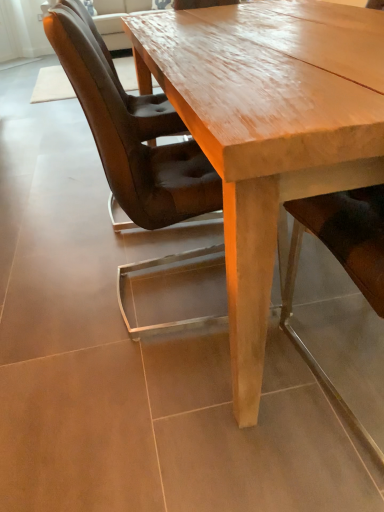
Question: Is the depth of smooth leather chair at center, which is the 2th chair from left to right, greater than that of brown leather chair at left, which appears as the second chair when viewed from the right?

Choices:
 (A) no
 (B) yes

Answer: (A)

Question: Are smooth leather chair at center, which is the 2th chair from left to right, and brown leather chair at left, which is the second chair in front-to-back order, located far from each other?

Choices:
 (A) yes
 (B) no

Answer: (B)

Question: Is smooth leather chair at center, the first chair when ordered from front to back, wider than brown leather chair at left, which appears as the second chair when viewed from the right?

Choices:
 (A) no
 (B) yes

Answer: (B)

Question: Is smooth leather chair at center, positioned as the second chair in back-to-front order, aimed at brown leather chair at left, which is the second chair in front-to-back order?

Choices:
 (A) yes
 (B) no

Answer: (B)

Question: From a real-world perspective, does smooth leather chair at center, positioned as the second chair in back-to-front order, sit lower than brown leather chair at left, which ranks as the 1th chair in left-to-right order?

Choices:
 (A) yes
 (B) no

Answer: (A)

Question: Is brown leather chair at left, the first chair viewed from the back, spatially inside light brown polished wood table at center, or outside of it?

Choices:
 (A) inside
 (B) outside

Answer: (A)

Question: Looking at the image, does brown leather chair at left, which appears as the second chair when viewed from the right, seem bigger or smaller compared to light brown polished wood table at center?

Choices:
 (A) small
 (B) big

Answer: (A)

Question: From the image's perspective, is brown leather chair at left, which appears as the second chair when viewed from the right, positioned above or below light brown polished wood table at center?

Choices:
 (A) above
 (B) below

Answer: (A)

Question: From a real-world perspective, is brown leather chair at left, which is the second chair in front-to-back order, physically located above or below light brown polished wood table at center?

Choices:
 (A) above
 (B) below

Answer: (A)

Question: In terms of height, does light brown polished wood table at center look taller or shorter compared to brown leather chair at left, which appears as the second chair when viewed from the right?

Choices:
 (A) short
 (B) tall

Answer: (A)

Question: Considering their positions, is light brown polished wood table at center located in front of or behind brown leather chair at left, which appears as the second chair when viewed from the right?

Choices:
 (A) front
 (B) behind

Answer: (A)

Question: Considering the positions of light brown polished wood table at center and brown leather chair at left, the first chair viewed from the back, in the image, is light brown polished wood table at center wider or thinner than brown leather chair at left, the first chair viewed from the back,?

Choices:
 (A) thin
 (B) wide

Answer: (B)

Question: Considering the relative positions of light brown polished wood table at center and brown leather chair at left, which is the second chair in front-to-back order, in the image provided, is light brown polished wood table at center to the left or to the right of brown leather chair at left, which is the second chair in front-to-back order,?

Choices:
 (A) right
 (B) left

Answer: (A)

Question: In the image, is smooth leather chair at center, the first chair when ordered from front to back, positioned in front of or behind light brown polished wood table at center?

Choices:
 (A) behind
 (B) front

Answer: (B)

Question: In terms of size, does smooth leather chair at center, which is the 2th chair from left to right, appear bigger or smaller than light brown polished wood table at center?

Choices:
 (A) big
 (B) small

Answer: (B)